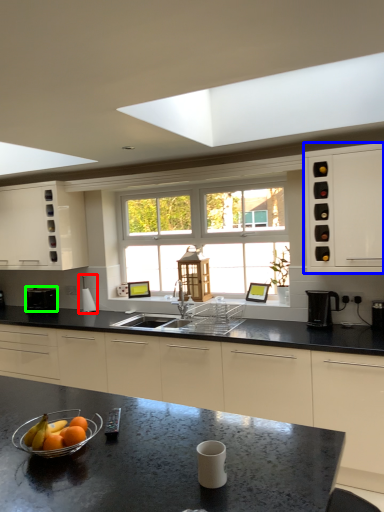
Question: Which object is positioned closest to appliance (highlighted by a red box)? Select from cabinetry (highlighted by a blue box) and appliance (highlighted by a green box).

Choices:
 (A) cabinetry
 (B) appliance

Answer: (B)